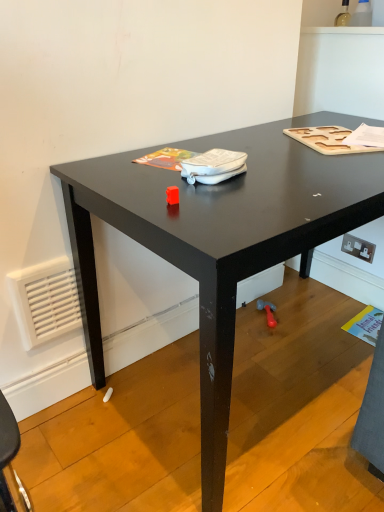
The image size is (384, 512). In order to click on vacant region under matte black table at center (from a real-world perspective) in this screenshot , I will do tap(253, 373).